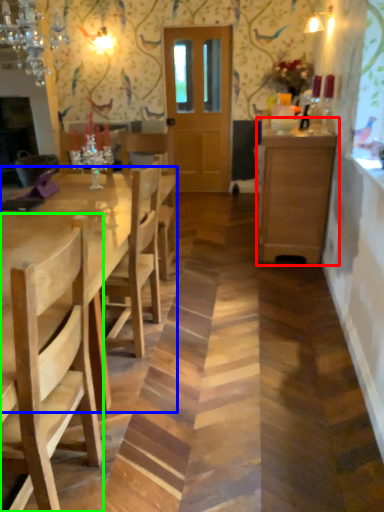
Question: Which object is positioned farthest from cabinetry (highlighted by a red box)? Select from kitchen & dining room table (highlighted by a blue box) and chair (highlighted by a green box).

Choices:
 (A) kitchen & dining room table
 (B) chair

Answer: (B)